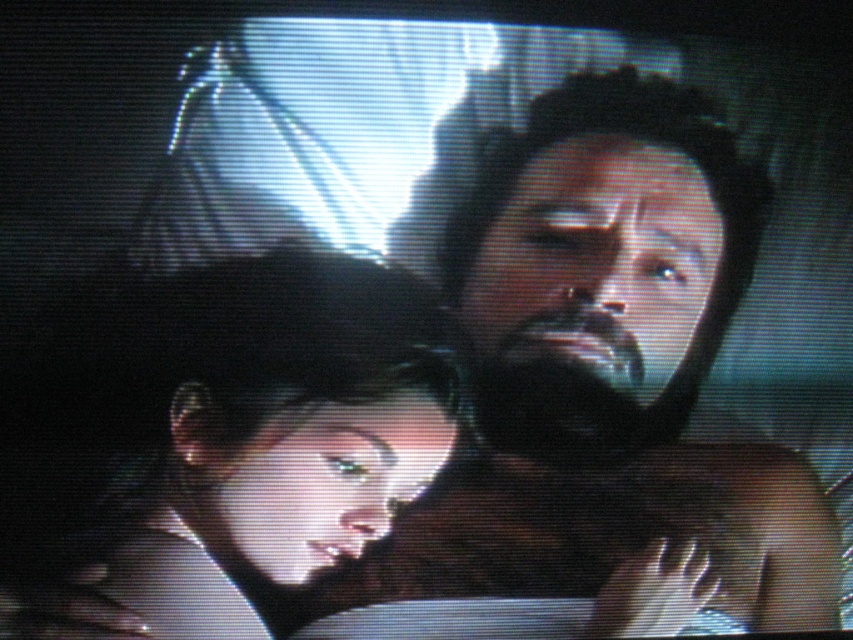
You are a character in a historical drama series. You are looking at the TV screen and see the dark brown hair at center and the smooth skin face at center. Which object is closer to you?

The dark brown hair at center is closer to the viewer than the smooth skin face at center.

You are a photographer adjusting the focus on a camera. The camera can only focus on objects within a 5 inch range. You need to capture both the dark brown hair at center and the smooth skin face at center in focus. Can you achieve this with the current camera settings?

The dark brown hair at center and smooth skin face at center are 7.97 inches apart, which exceeds the camera focus range of 5 inches. Therefore, you cannot capture both in focus simultaneously with the current settings.

You are a camera operator trying to adjust your position to focus on a specific point in the scene. The point you need to focus on is located at coordinates point (469, 397). Given that the distance from the camera to this point is 1.31 meters, can you confirm if this point is within the camera frame?

The distance of point (469, 397) from camera is 1.31 meters, so yes, the point is within the camera frame since it is within the camera range.